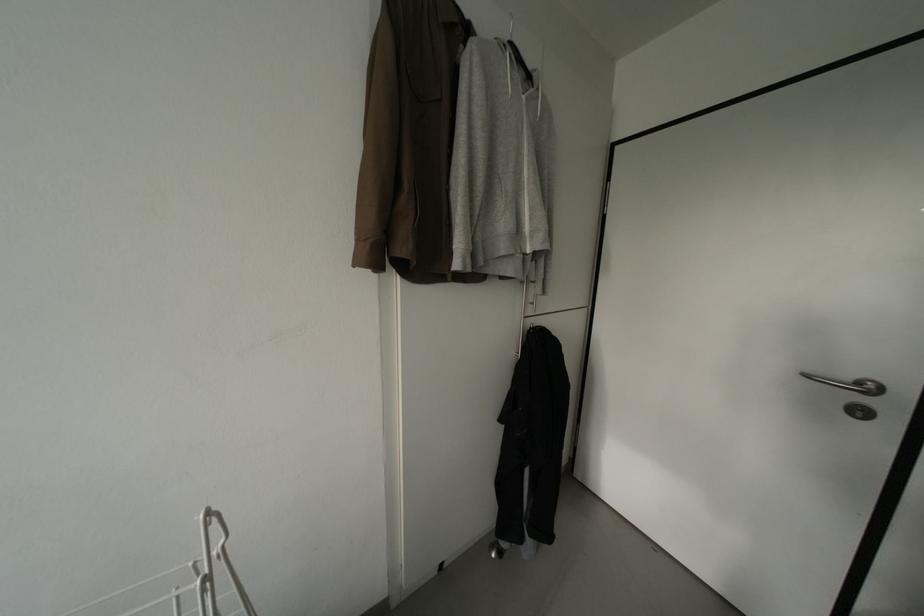
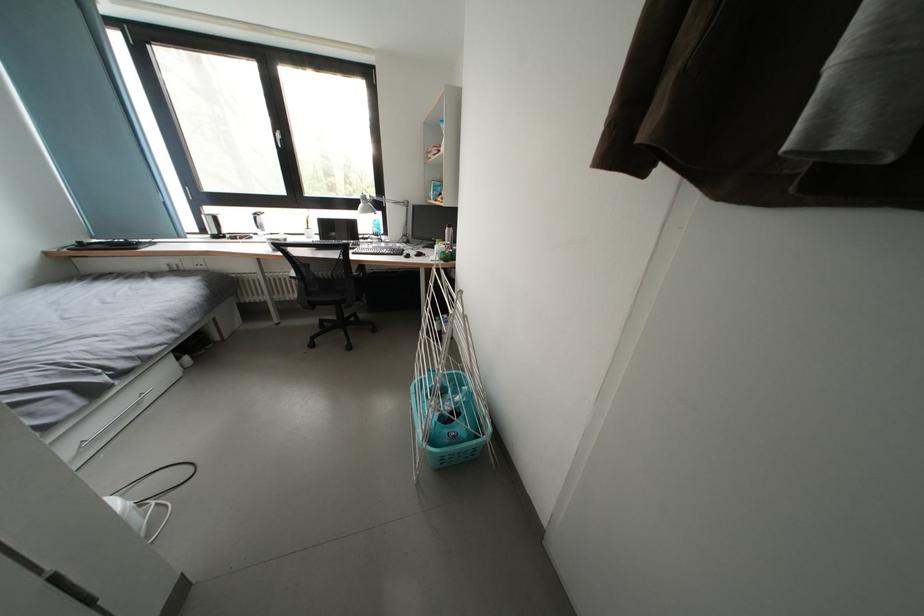
Based on the continuous images, in which direction is the camera rotating?

The camera rotated toward left-down.